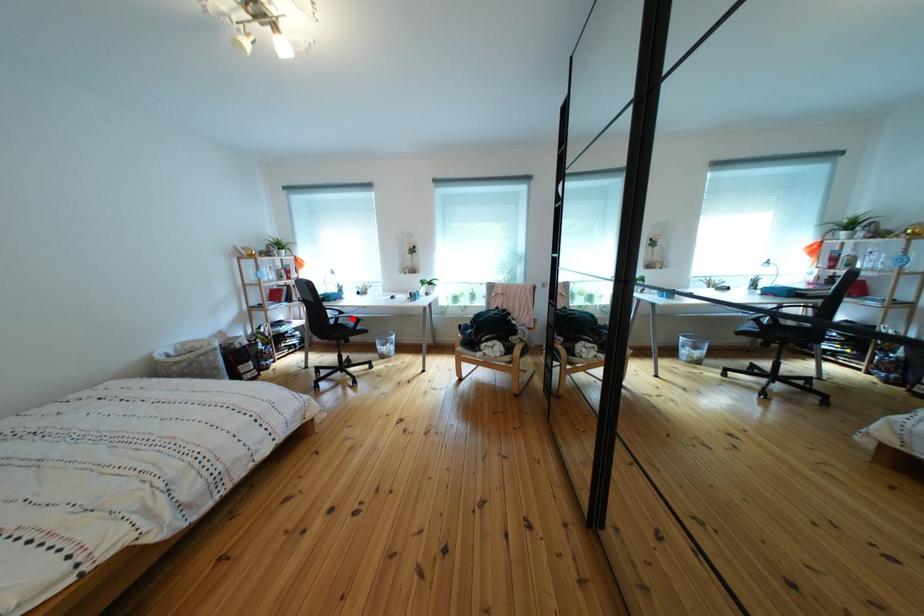
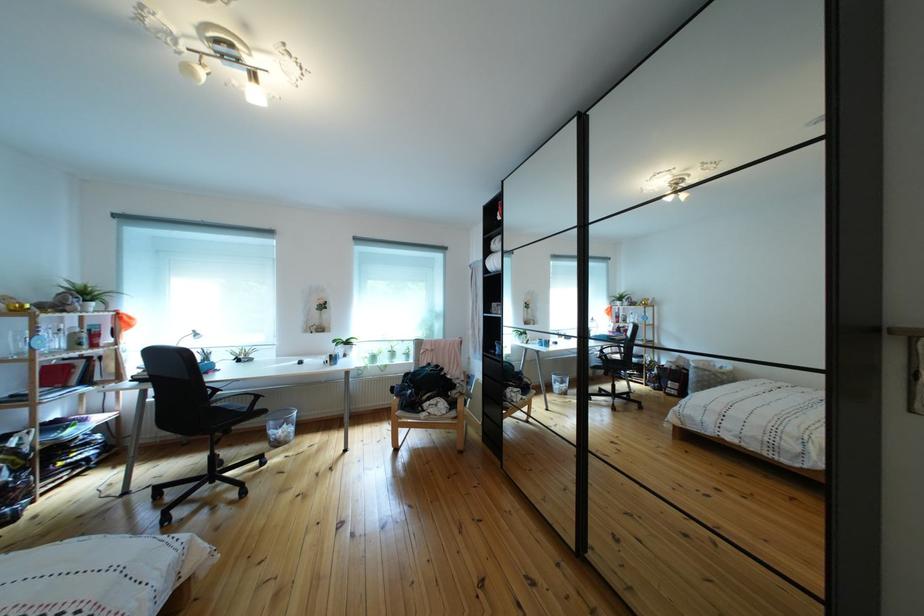
Question: A red point is marked in image1. In image2, is the corresponding 3D point closer to the camera or farther? Reply with the corresponding letter.

Choices:
 (A) The corresponding 3D point is closer.
 (B) The corresponding 3D point is farther.

Answer: (B)